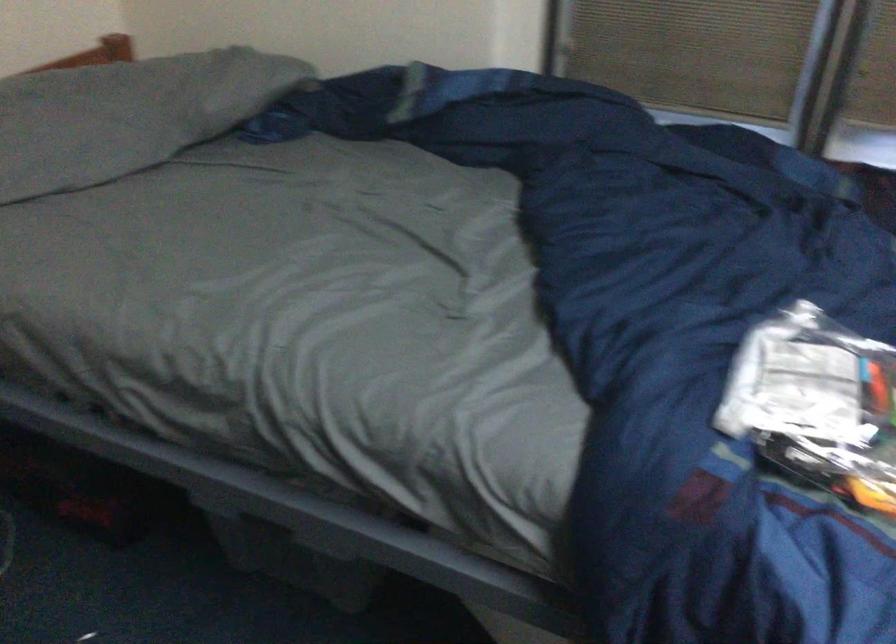
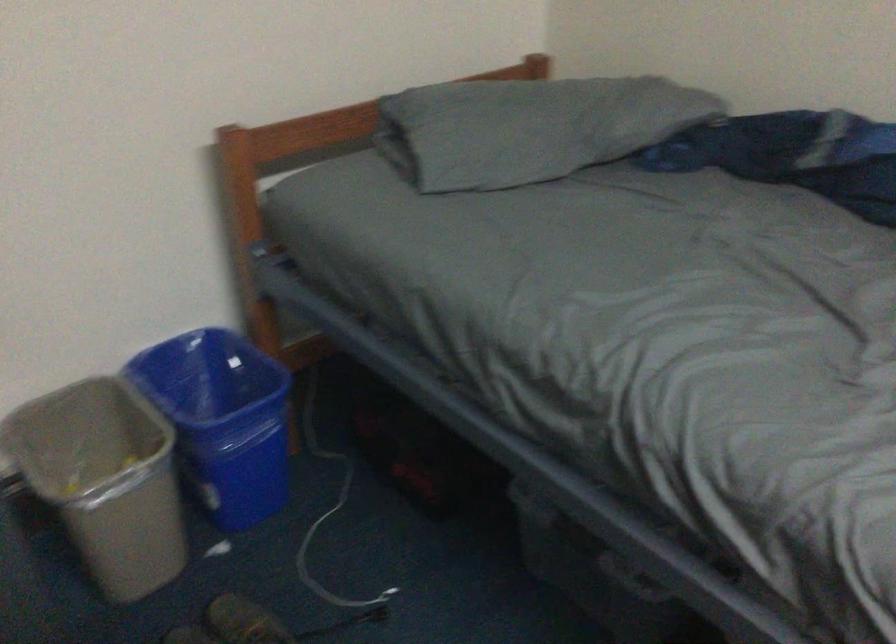
Find the pixel in the second image that matches point (116, 118) in the first image.

(529, 128)